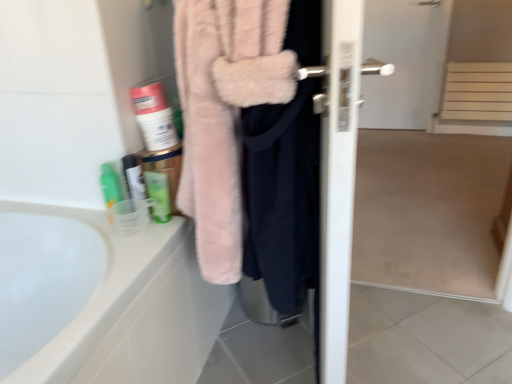
Question: Considering the positions of green matte tube at upper left, the 1th toiletry viewed from the right, and translucent plastic cup at lower left, the second toiletry positioned from the left, in the image, is green matte tube at upper left, the 1th toiletry viewed from the right, wider or thinner than translucent plastic cup at lower left, the second toiletry positioned from the left,?

Choices:
 (A) wide
 (B) thin

Answer: (A)

Question: From a real-world perspective, is green matte tube at upper left, the 1th toiletry viewed from the right, positioned above or below translucent plastic cup at lower left, placed as the second toiletry when sorted from right to left?

Choices:
 (A) below
 (B) above

Answer: (A)

Question: Based on their relative distances, which object is farther from the fuzzy pink robe at center?

Choices:
 (A) translucent plastic cup at lower left, the second toiletry positioned from the left
 (B) white matte bottle at upper left
 (C) white matte screen door at center
 (D) green matte tube at upper left, the 1th toiletry viewed from the right
 (E) translucent plastic cup at lower left, arranged as the 1th toiletry when viewed from the left

Answer: (C)

Question: Estimate the real-world distances between objects in this image. Which object is farther from the translucent plastic cup at lower left, the second toiletry positioned from the left?

Choices:
 (A) translucent plastic cup at lower left, arranged as the third toiletry when viewed from the right
 (B) white matte bottle at upper left
 (C) green matte tube at upper left, positioned as the 3th toiletry in left-to-right order
 (D) fuzzy pink robe at center
 (E) white matte screen door at center

Answer: (E)